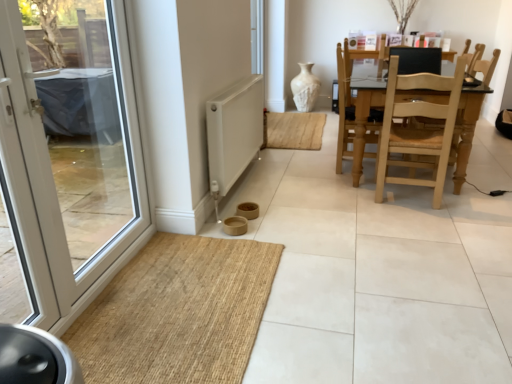
I want to click on vacant location below white matte radiator at lower center (from a real-world perspective), so click(245, 187).